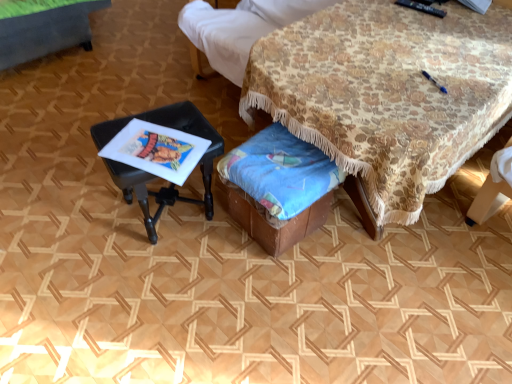
The image size is (512, 384). I want to click on free space in front of floral fabric table at center, the 1th table from the right, so click(x=374, y=301).